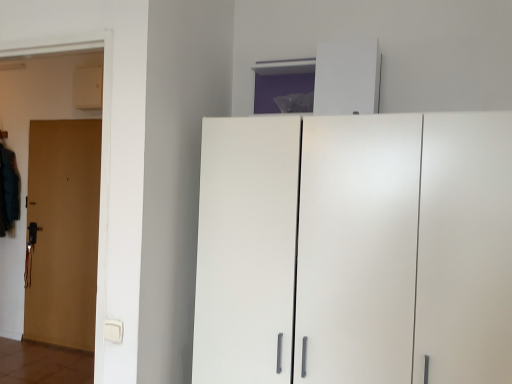
What do you see at coordinates (355, 249) in the screenshot?
I see `white matte cabinet at center` at bounding box center [355, 249].

Where is `white matte cabinet at center`? white matte cabinet at center is located at coordinates (355, 249).

Find the location of a particular element. The width and height of the screenshot is (512, 384). white matte cabinet at center is located at coordinates (355, 249).